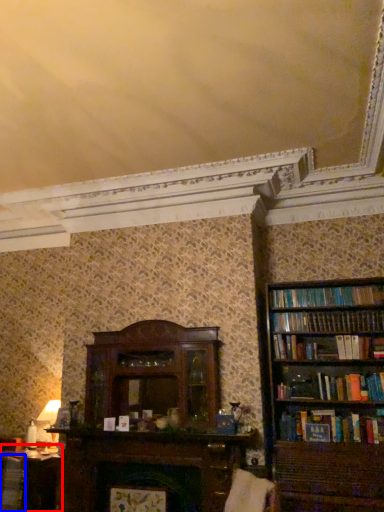
Question: Which point is closer to the camera, table (highlighted by a red box) or book (highlighted by a blue box)?

Choices:
 (A) table
 (B) book

Answer: (B)